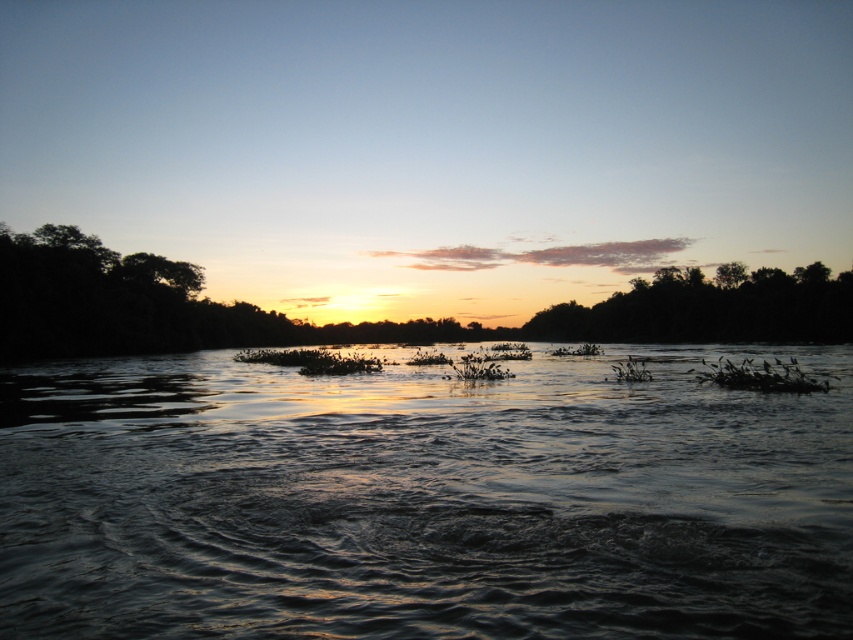
You are standing at the edge of the water and want to place a 3.5 meter long wooden board between the dark reflective water at center and the nearest vegetation patch. Will the board reach both points?

The distance between the dark reflective water at center and the nearest vegetation patch is 4.52 meters. Since the board is only 3.5 meters long, it will not be long enough to span the gap between them.